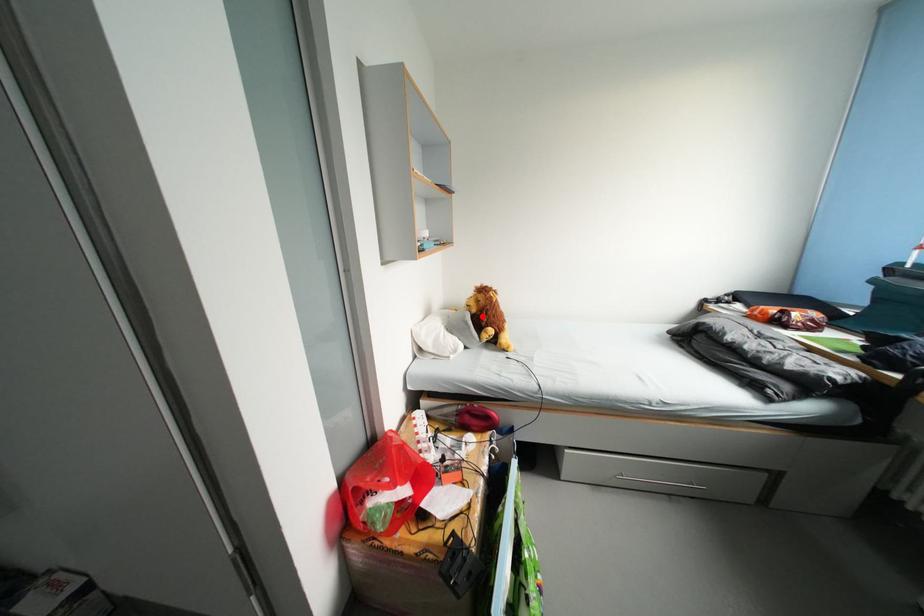
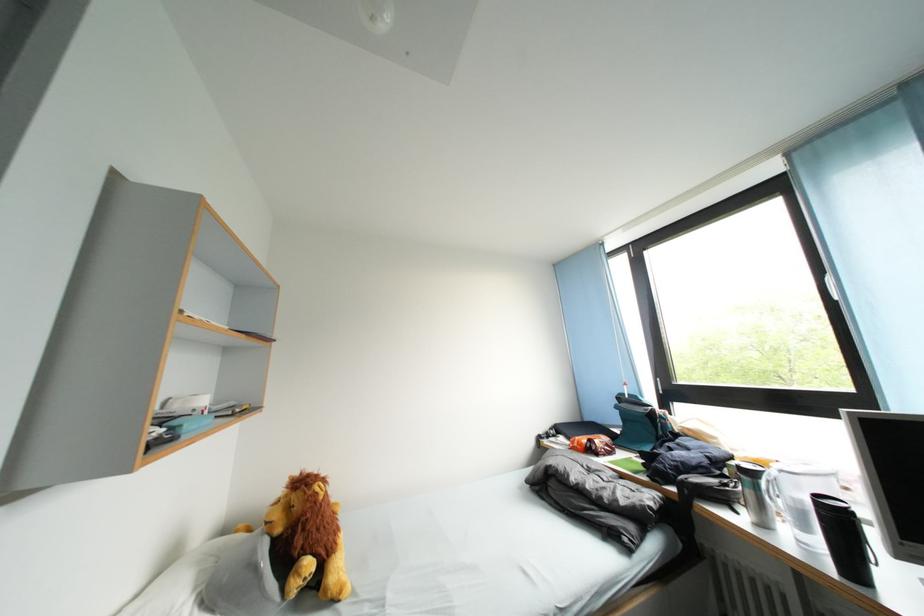
Where in the second image is the point corresponding to the highlighted location from the first image?

(287, 535)